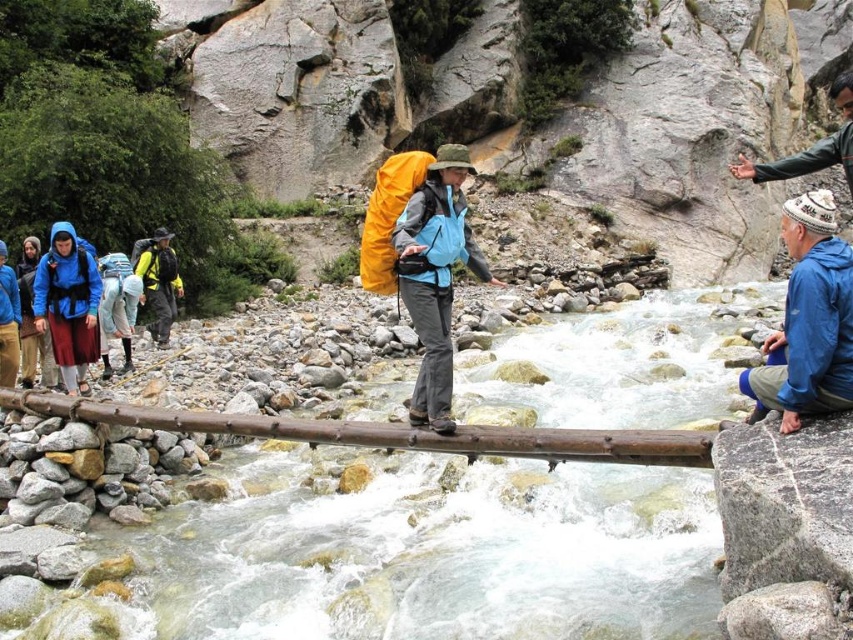
You are a hiker trying to cross the river using the wooden bridge. You see the blue fleece jacket at lower right and the matte blue jacket at left in the scene. Which jacket is positioned closer to the right side of the bridge?

The blue fleece jacket at lower right is positioned to the right of the matte blue jacket at left, so the blue fleece jacket at lower right is closer to the right side of the bridge.

You are a hiker planning to cross the river using the wooden bridge. You notice the blue fleece jacket at lower right. Based on its position, which direction should you look to see it from the bridge?

The blue fleece jacket at lower right is located at point (808, 321), so you should look to your lower right direction from the bridge to see it.

You are a hiker trying to cross the river using the wooden bridge. Your goal is to reach the blue fleece jacket at lower right. Based on the coordinates provided, is the jacket located to the left or right side of the bridge?

The blue fleece jacket at lower right is located at point (808, 321). Since the x coordinate is 0.502, which is just over halfway across the bridge, the jacket is positioned slightly to the right side of the bridge.